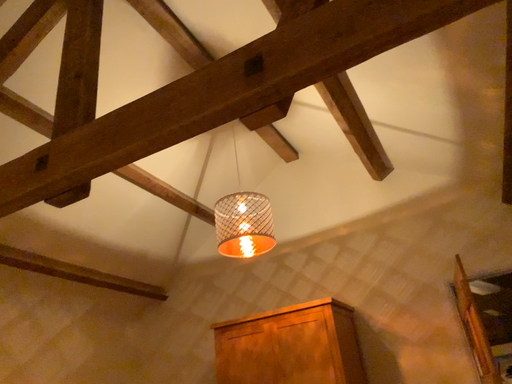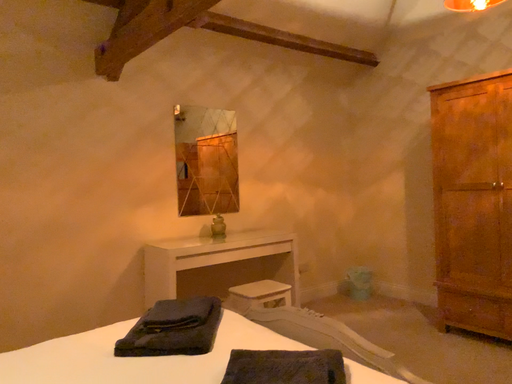
Question: Which way did the camera rotate in the video?

Choices:
 (A) rotated left
 (B) rotated right

Answer: (A)